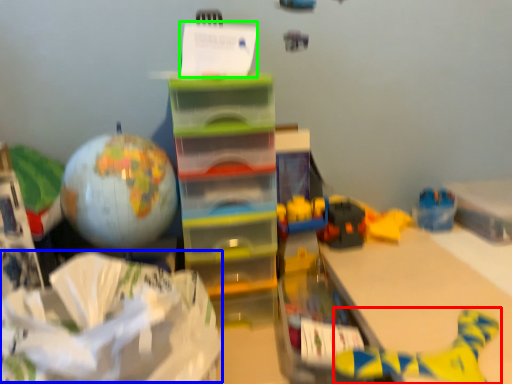
Question: Based on their relative distances, which object is farther from toy (highlighted by a red box)? Choose from wrapping paper (highlighted by a blue box) and writing (highlighted by a green box).

Choices:
 (A) wrapping paper
 (B) writing

Answer: (B)